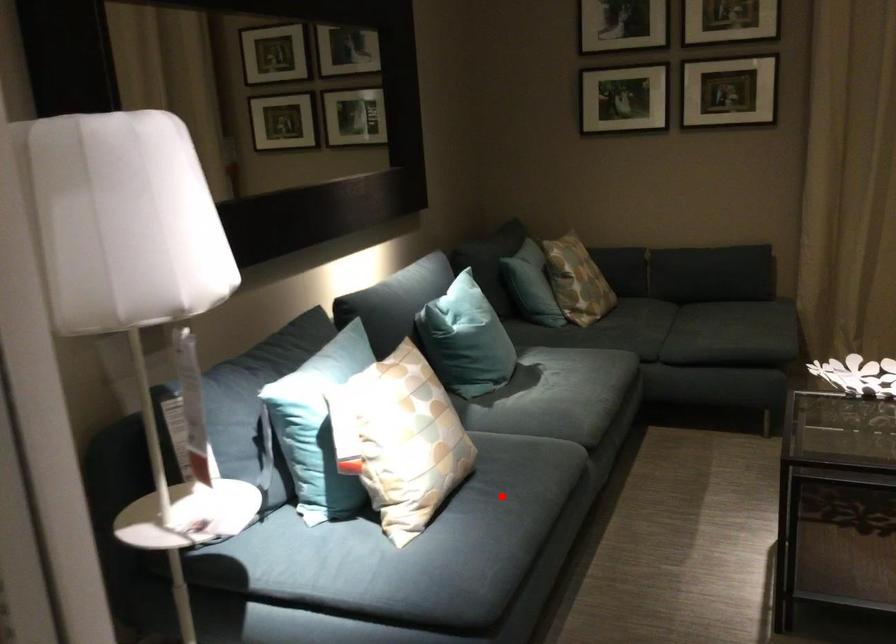
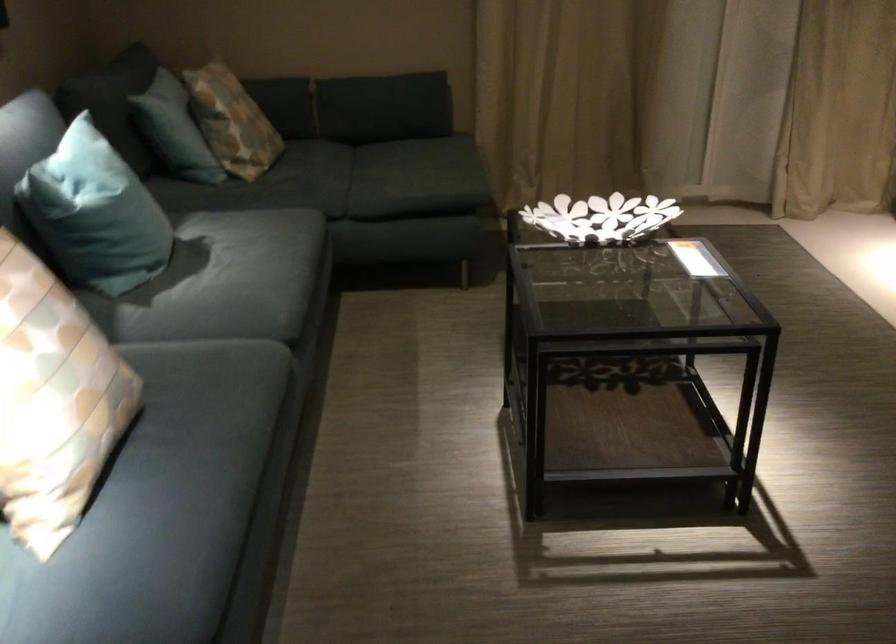
Question: I am providing you with two images of the same scene from different viewpoints. A red point is shown in image1. For the corresponding object point in image2, is it positioned nearer or farther from the camera?

Choices:
 (A) Nearer
 (B) Farther

Answer: (A)